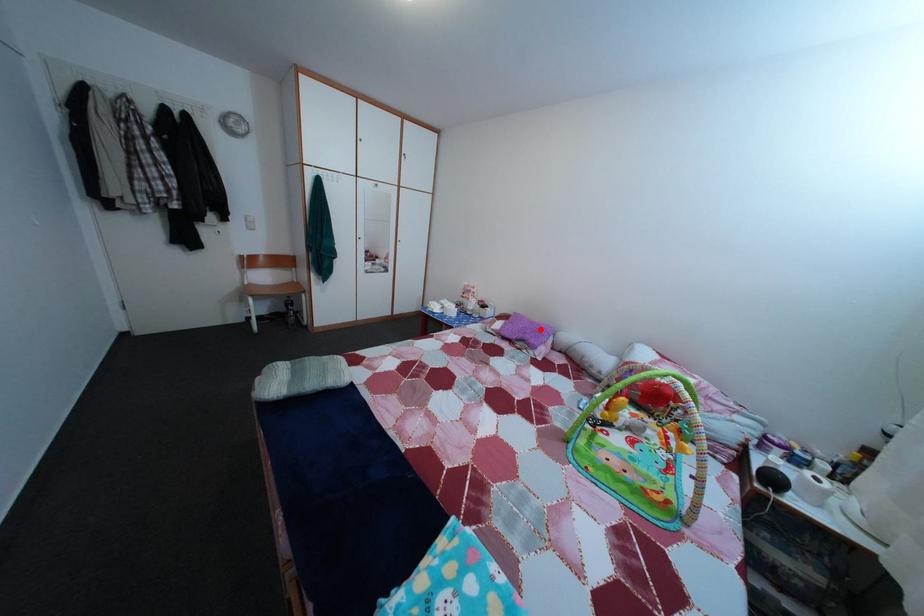
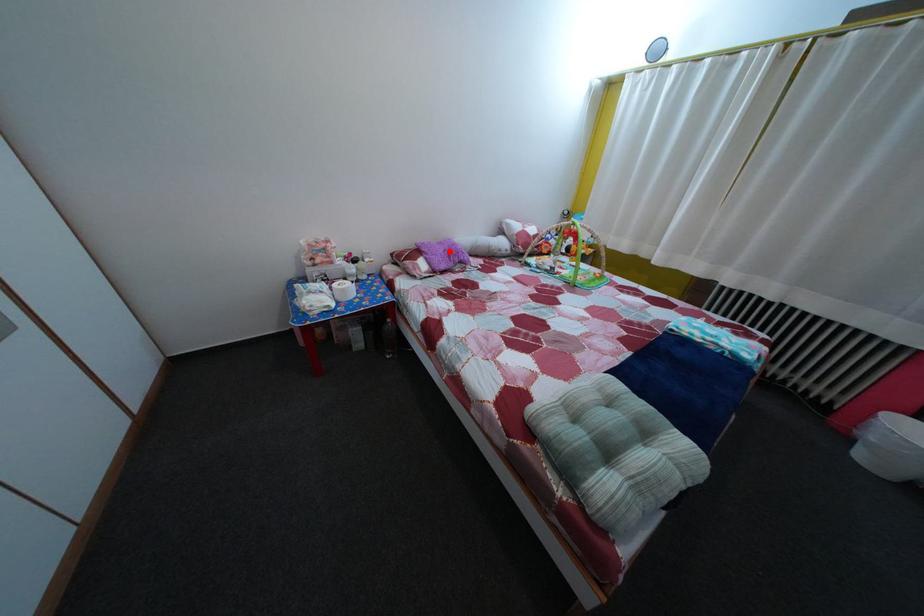
Consider the image. I am providing you with two images of the same scene from different viewpoints. A red point is marked on the first image and another point is marked on the second image. Are the points marked in image1 and image2 representing the same 3D position?

Yes